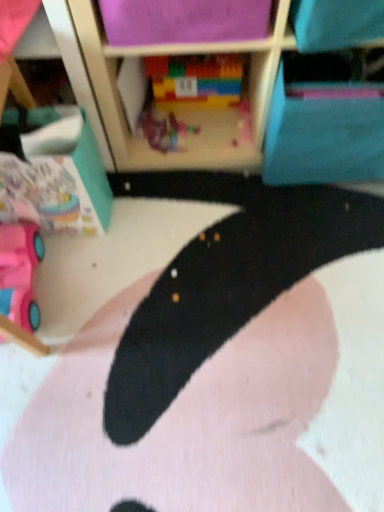
Question: Is multicolored plastic blocks at center, placed as the first toy when sorted from top to bottom, to the left or to the right of pink plastic toy car at lower left, the 3th toy when ordered from right to left, in the image?

Choices:
 (A) right
 (B) left

Answer: (A)

Question: From a real-world perspective, is multicolored plastic blocks at center, placed as the first toy when sorted from top to bottom, physically located above or below pink plastic toy car at lower left, marked as the first toy in a left-to-right arrangement?

Choices:
 (A) below
 (B) above

Answer: (B)

Question: Considering the real-world distances, which object is farthest from the pink plastic toy car at lower left, the 3th toy when ordered from right to left?

Choices:
 (A) black matte rug at center
 (B) blue fabric cabinet at upper right
 (C) plastic toy at center, acting as the second toy starting from the bottom
 (D) multicolored plastic blocks at center, which is the 3th toy from bottom to top

Answer: (B)

Question: Which of these objects is positioned farthest from the blue fabric cabinet at upper right?

Choices:
 (A) pink plastic toy car at lower left, marked as the first toy in a left-to-right arrangement
 (B) black matte rug at center
 (C) multicolored plastic blocks at center, the 1th toy positioned from the right
 (D) plastic toy at center, the second toy viewed from the right

Answer: (A)